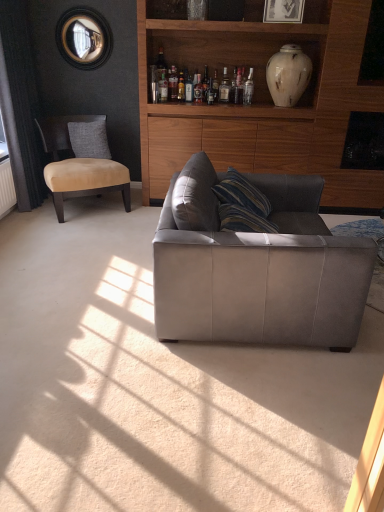
Question: Which direction should I rotate to look at translucent glass bottle at upper center, which is the third bottle from right to left?

Choices:
 (A) left
 (B) right

Answer: (A)

Question: Is clear glass bottle at upper center, placed as the first bottle when sorted from right to left, far from wooden cabinet at upper center?

Choices:
 (A) no
 (B) yes

Answer: (A)

Question: Is clear glass bottle at upper center, the 5th bottle from the left, turned away from wooden cabinet at upper center?

Choices:
 (A) no
 (B) yes

Answer: (B)

Question: Does clear glass bottle at upper center, placed as the first bottle when sorted from right to left, have a larger size compared to wooden cabinet at upper center?

Choices:
 (A) yes
 (B) no

Answer: (B)

Question: From the image's perspective, is clear glass bottle at upper center, the 5th bottle from the left, below wooden cabinet at upper center?

Choices:
 (A) no
 (B) yes

Answer: (A)

Question: From a real-world perspective, is clear glass bottle at upper center, the 5th bottle from the left, beneath wooden cabinet at upper center?

Choices:
 (A) no
 (B) yes

Answer: (A)

Question: From the image's perspective, would you say clear glass bottle at upper center, placed as the first bottle when sorted from right to left, is positioned over wooden cabinet at upper center?

Choices:
 (A) yes
 (B) no

Answer: (A)

Question: Can you confirm if suede gray couch at center is smaller than translucent glass bottle at upper center, which is the third bottle from right to left?

Choices:
 (A) yes
 (B) no

Answer: (B)

Question: Can you confirm if suede gray couch at center is taller than translucent glass bottle at upper center, which is the third bottle from right to left?

Choices:
 (A) yes
 (B) no

Answer: (A)

Question: Can you confirm if suede gray couch at center is thinner than translucent glass bottle at upper center, which is the third bottle from right to left?

Choices:
 (A) no
 (B) yes

Answer: (A)

Question: From the image's perspective, is suede gray couch at center located above translucent glass bottle at upper center, which is the third bottle from right to left?

Choices:
 (A) yes
 (B) no

Answer: (B)

Question: Can you confirm if suede gray couch at center is wider than translucent glass bottle at upper center, placed as the 3th bottle when sorted from left to right?

Choices:
 (A) no
 (B) yes

Answer: (B)

Question: Is the depth of suede gray couch at center greater than that of translucent glass bottle at upper center, which is the third bottle from right to left?

Choices:
 (A) no
 (B) yes

Answer: (A)

Question: Considering the relative sizes of clear glass bottle at upper center, the 5th bottle in the right-to-left sequence, and suede beige chair at left in the image provided, is clear glass bottle at upper center, the 5th bottle in the right-to-left sequence, bigger than suede beige chair at left?

Choices:
 (A) yes
 (B) no

Answer: (B)